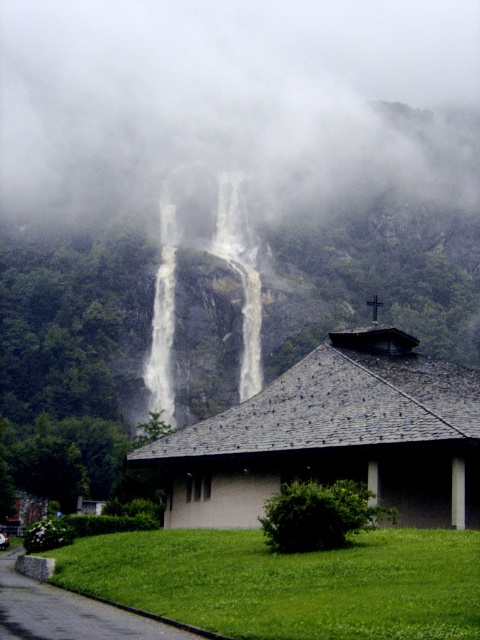
Question: Is foggy mist at center bigger than white smooth waterfall at center?

Choices:
 (A) no
 (B) yes

Answer: (B)

Question: Is white textured waterfall at center behind white smooth waterfall at center?

Choices:
 (A) yes
 (B) no

Answer: (A)

Question: Which object is the farthest from the gray slate roof hut at center?

Choices:
 (A) white smooth waterfall at center
 (B) white textured waterfall at center
 (C) foggy mist at center
 (D) white frothy water at center

Answer: (C)

Question: Which of the following is the farthest from the observer?

Choices:
 (A) white textured waterfall at center
 (B) white smooth waterfall at center

Answer: (A)

Question: Is foggy mist at center behind white textured waterfall at center?

Choices:
 (A) yes
 (B) no

Answer: (A)

Question: Which point appears closest to the camera in this image?

Choices:
 (A) (251, 228)
 (B) (284, 380)
 (C) (160, 218)
 (D) (223, 225)

Answer: (B)